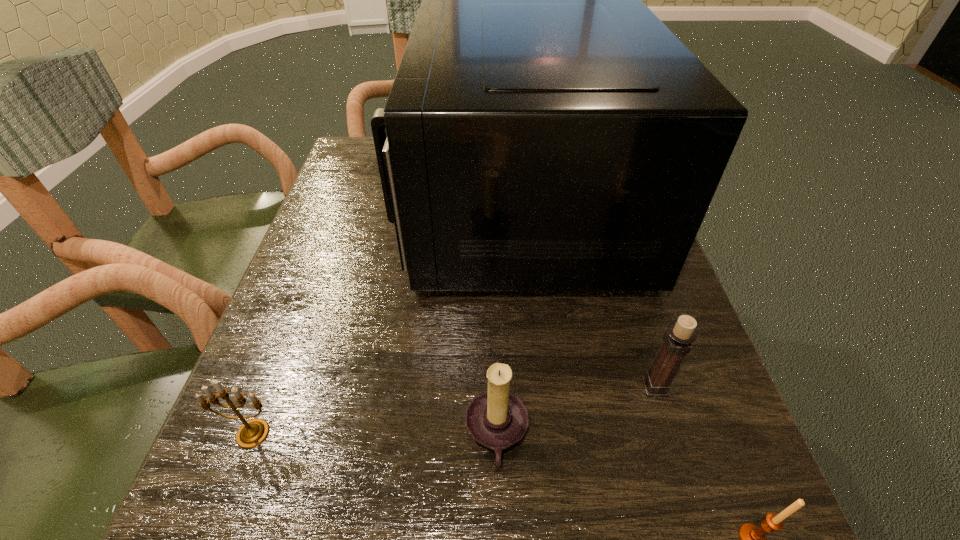
Image resolution: width=960 pixels, height=540 pixels. Identify the location of the farthest object. (545, 131).

At what (x,y) coordinates should I click in order to perform the action: click on the tallest object. Please return your answer as a coordinate pair (x, y). Looking at the image, I should click on (545, 131).

You are a GUI agent. You are given a task and a screenshot of the screen. Output one action in this format:
    pyautogui.click(x=<x>, y=<y>)
    Task: Click on the second candle_holder from right to left
    
    Given the screenshot: What is the action you would take?
    pyautogui.click(x=677, y=340)

Where is `the second farthest object`? The image size is (960, 540). the second farthest object is located at coordinates (677, 340).

At what (x,y) coordinates should I click in order to perform the action: click on the third candle_holder from right to left. Please return your answer as a coordinate pair (x, y). This screenshot has height=540, width=960. Looking at the image, I should click on (496, 418).

Identify the location of the leftmost object. Image resolution: width=960 pixels, height=540 pixels. (252, 433).

This screenshot has height=540, width=960. I want to click on free space located on the front-facing side of the tallest object, so click(377, 207).

Where is `vacant space situated 0.130m on the front-facing side of the tallest object`? Image resolution: width=960 pixels, height=540 pixels. vacant space situated 0.130m on the front-facing side of the tallest object is located at coordinates (347, 207).

The image size is (960, 540). In order to click on vacant position located 0.120m on the front-facing side of the tallest object in this screenshot , I will do `click(350, 207)`.

In order to click on vacant space located on the left of the farthest candle_holder in this screenshot , I will do `click(596, 387)`.